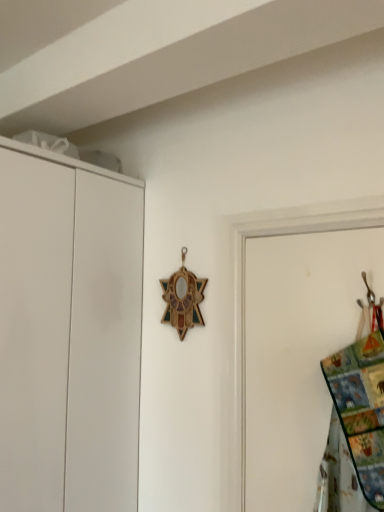
Question: Is multicolored fabric at right thinner than white matte cupboard at left?

Choices:
 (A) no
 (B) yes

Answer: (B)

Question: Can you confirm if multicolored fabric at right is bigger than white matte cupboard at left?

Choices:
 (A) yes
 (B) no

Answer: (B)

Question: Is multicolored fabric at right oriented towards white matte cupboard at left?

Choices:
 (A) yes
 (B) no

Answer: (B)

Question: Can you confirm if multicolored fabric at right is positioned to the right of white matte cupboard at left?

Choices:
 (A) no
 (B) yes

Answer: (B)

Question: Is multicolored fabric at right with white matte cupboard at left?

Choices:
 (A) yes
 (B) no

Answer: (B)

Question: From the image's perspective, is multicolored fabric at right under white matte cupboard at left?

Choices:
 (A) yes
 (B) no

Answer: (B)

Question: Is white matte cupboard at left bigger than multicolored fabric at right?

Choices:
 (A) yes
 (B) no

Answer: (A)

Question: From the image's perspective, is white matte cupboard at left above multicolored fabric at right?

Choices:
 (A) no
 (B) yes

Answer: (A)

Question: Can you confirm if white matte cupboard at left is thinner than multicolored fabric at right?

Choices:
 (A) no
 (B) yes

Answer: (A)

Question: Is multicolored fabric at right at the back of white matte cupboard at left?

Choices:
 (A) yes
 (B) no

Answer: (B)

Question: From a real-world perspective, is white matte cupboard at left below multicolored fabric at right?

Choices:
 (A) no
 (B) yes

Answer: (A)

Question: Does white matte cupboard at left contain multicolored fabric at right?

Choices:
 (A) yes
 (B) no

Answer: (B)

Question: In terms of width, does white matte cupboard at left look wider or thinner when compared to multicolored fabric at right?

Choices:
 (A) thin
 (B) wide

Answer: (B)